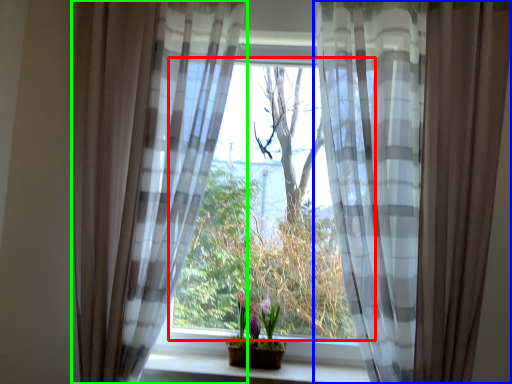
Question: Considering the real-world distances, which object is closest to window (highlighted by a red box)? curtain (highlighted by a blue box) or curtain (highlighted by a green box).

Choices:
 (A) curtain
 (B) curtain

Answer: (B)